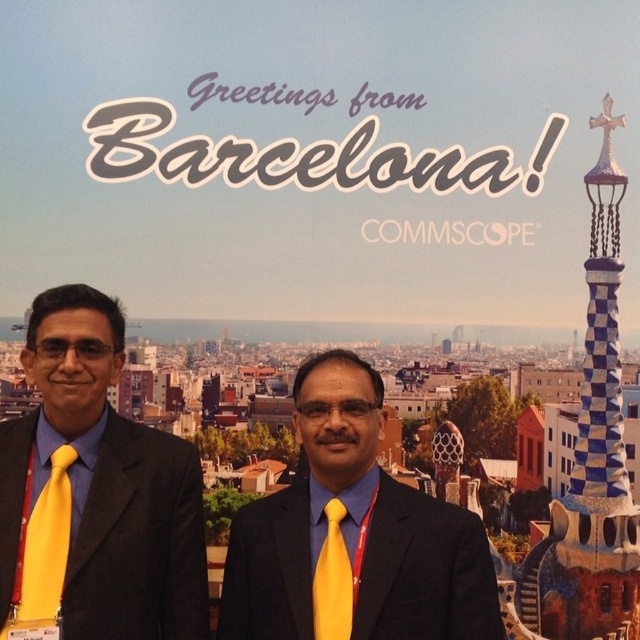
Is matte black suit at left taller than yellow matte suit at center?

Indeed, matte black suit at left has a greater height compared to yellow matte suit at center.

Consider the image. Who is more distant from viewer, (26, 579) or (456, 556)?

Positioned behind is point (456, 556).

At what (x,y) coordinates should I click in order to perform the action: click on matte black suit at left. Please return your answer as a coordinate pair (x, y). This screenshot has width=640, height=640. Looking at the image, I should click on (97, 490).

Is point (264, 576) positioned before point (330, 634)?

No, it is behind (330, 634).

Does point (275, 536) come farther from viewer compared to point (352, 588)?

Yes.

Does point (244, 563) come closer to viewer compared to point (332, 621)?

No, (244, 563) is behind (332, 621).

Where is `yellow matte suit at center`? yellow matte suit at center is located at coordinates (353, 536).

Can you confirm if yellow satin tie at left is smaller than yellow satin tie at center?

No, yellow satin tie at left is not smaller than yellow satin tie at center.

Identify the location of yellow satin tie at left. The width and height of the screenshot is (640, 640). (42, 556).

Is point (32, 589) more distant than point (317, 563)?

No, (32, 589) is closer to viewer.

This screenshot has width=640, height=640. What are the coordinates of `yellow satin tie at left` in the screenshot? It's located at [42, 556].